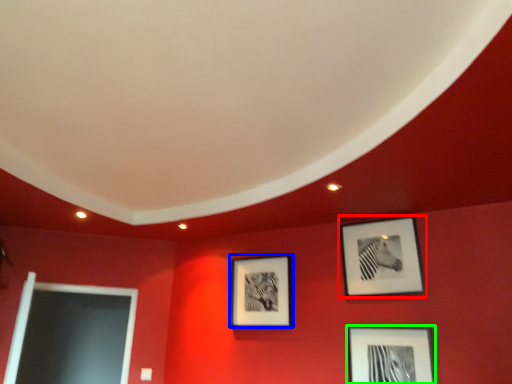
Question: Estimate the real-world distances between objects in this image. Which object is closer to picture frame (highlighted by a red box), picture frame (highlighted by a blue box) or picture frame (highlighted by a green box)?

Choices:
 (A) picture frame
 (B) picture frame

Answer: (B)